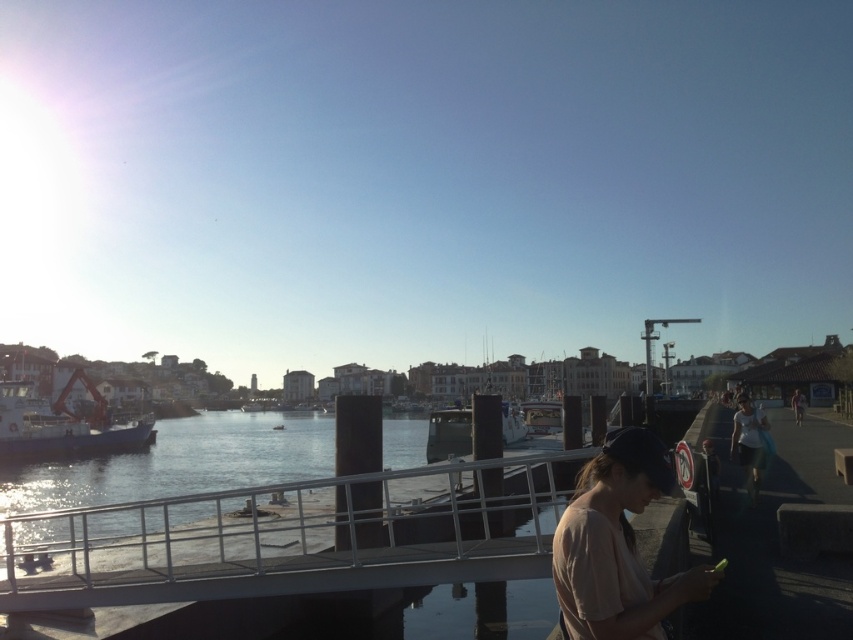
Question: Which is farther from the blue matte boat at left?

Choices:
 (A) white metal rail at lower center
 (B) white glossy boat at center
 (C) light brown leather jacket at lower right
 (D) light brown cotton shirt at lower right

Answer: (C)

Question: Is white cotton shirt at right bigger than light brown leather jacket at lower right?

Choices:
 (A) no
 (B) yes

Answer: (A)

Question: Which object appears closest to the camera in this image?

Choices:
 (A) blue matte boat at left
 (B) light brown cotton shirt at lower right

Answer: (B)

Question: Which object is positioned farthest from the light brown cotton shirt at lower right?

Choices:
 (A) white glossy boat at center
 (B) white cotton shirt at right

Answer: (A)

Question: Is blue matte boat at left thinner than white glossy boat at center?

Choices:
 (A) yes
 (B) no

Answer: (B)

Question: Can you confirm if white metal rail at lower center is positioned to the right of light brown cotton shirt at lower right?

Choices:
 (A) yes
 (B) no

Answer: (B)